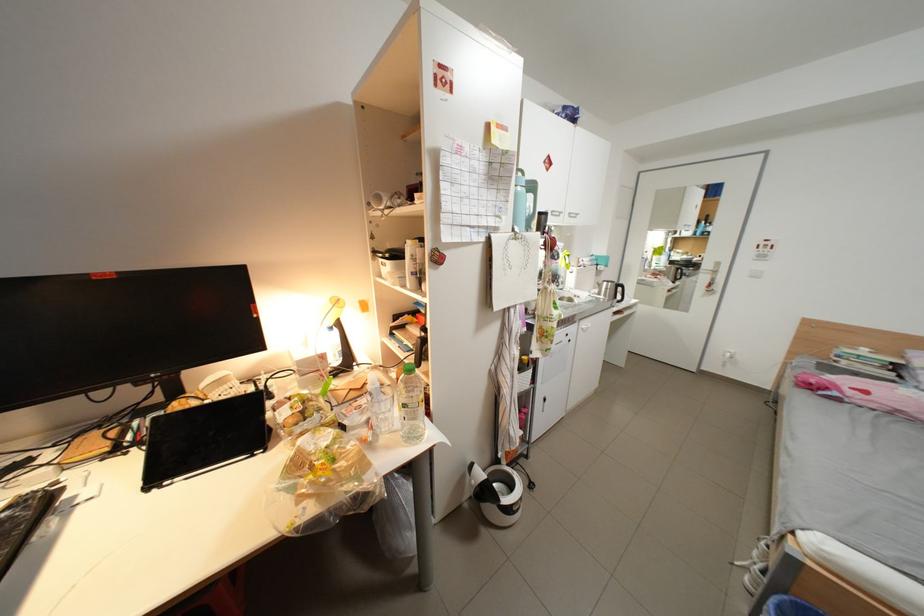
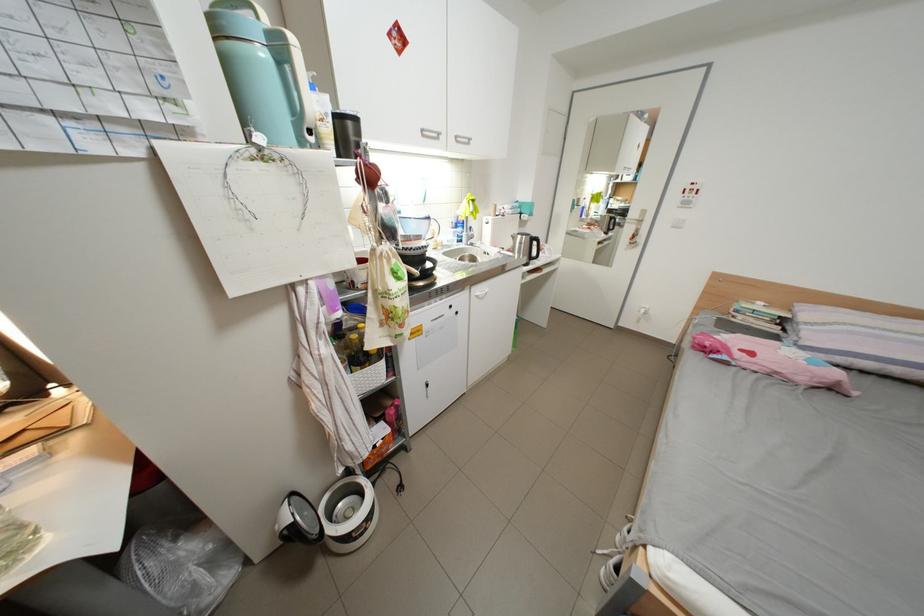
Question: The first image is from the beginning of the video and the second image is from the end. How did the camera likely rotate when shooting the video?

Choices:
 (A) Left
 (B) Right
 (C) Up
 (D) Down

Answer: (D)